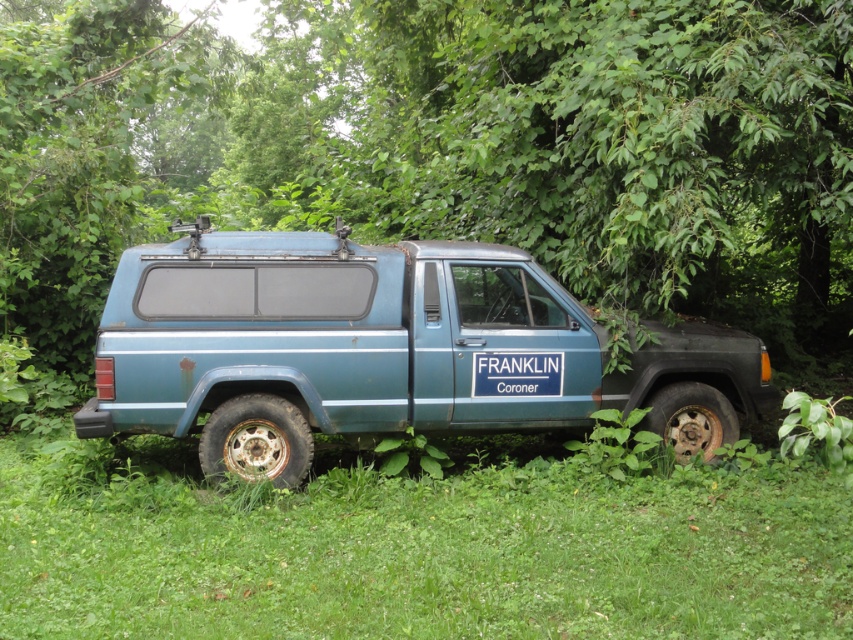
Between rusty teal van at center and rusty metal tire at lower right, which one has less height?

Standing shorter between the two is rusty metal tire at lower right.

Which is below, rusty teal van at center or rusty metal tire at lower right?

rusty metal tire at lower right is lower down.

Which is behind, point (514, 257) or point (712, 397)?

Point (712, 397)

Locate an element on the screen. rusty teal van at center is located at coordinates (368, 346).

Is green grassy at lower center below rusty metal tire at lower left?

Yes, green grassy at lower center is below rusty metal tire at lower left.

Can you confirm if green grassy at lower center is thinner than rusty metal tire at lower left?

In fact, green grassy at lower center might be wider than rusty metal tire at lower left.

Is point (68, 448) closer to camera compared to point (207, 452)?

No, it is behind (207, 452).

Find the location of `green grassy at lower center`. green grassy at lower center is located at coordinates (421, 550).

Based on the photo, is the position of green grassy at lower center more distant than that of rusty teal van at center?

That is False.

Is green grassy at lower center thinner than rusty teal van at center?

No.

Find the location of a particular element. Image resolution: width=853 pixels, height=640 pixels. green grassy at lower center is located at coordinates (421, 550).

Locate an element on the screen. The image size is (853, 640). green grassy at lower center is located at coordinates (421, 550).